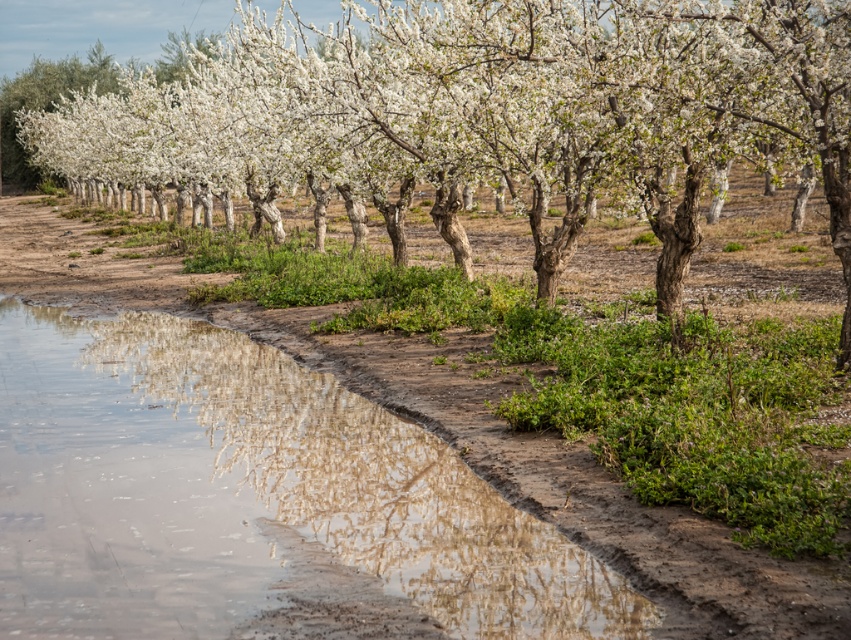
You are standing in the orchard and want to cross to the other side. There is a muddy water at lower left and a white blossoming tree at center. Which object should you avoid stepping on to stay dry?

You should avoid stepping on the muddy water at lower left because it is in front of the white blossoming tree at center, meaning it is closer to you and the path to cross.

You are a bird flying over the orchard and want to land on the tallest object in the scene. Which object should you choose between the muddy water at lower left and the white blossoming tree at center?

The white blossoming tree at center is taller than the muddy water at lower left, so you should land on the white blossoming tree at center.